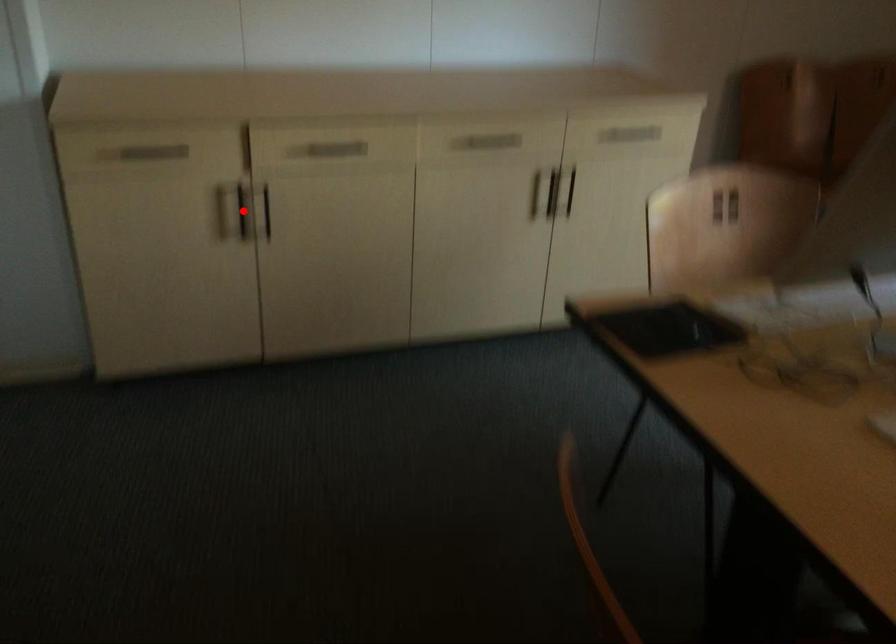
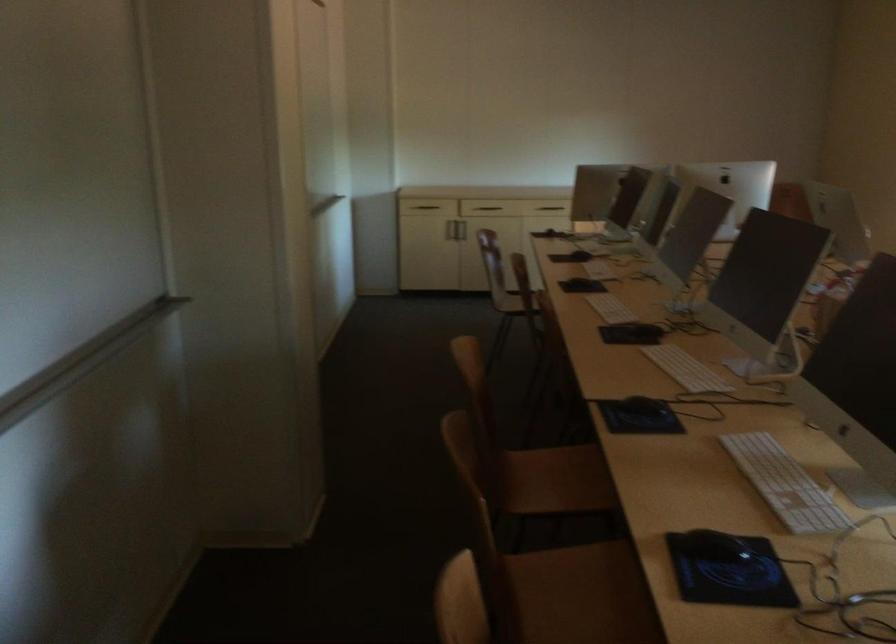
Question: A red point is marked in image1. In image2, is the corresponding 3D point closer to the camera or farther? Reply with the corresponding letter.

Choices:
 (A) The corresponding 3D point is closer.
 (B) The corresponding 3D point is farther.

Answer: (B)